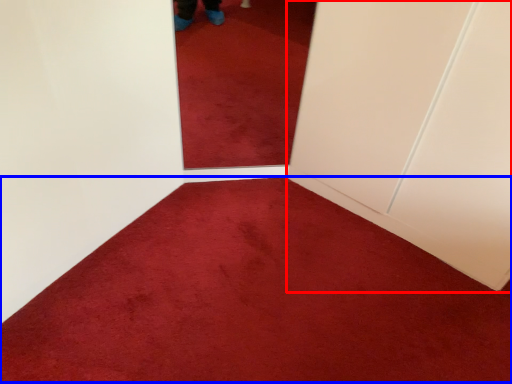
Question: Among these objects, which one is nearest to the camera, door (highlighted by a red box) or plain (highlighted by a blue box)?

Choices:
 (A) door
 (B) plain

Answer: (B)